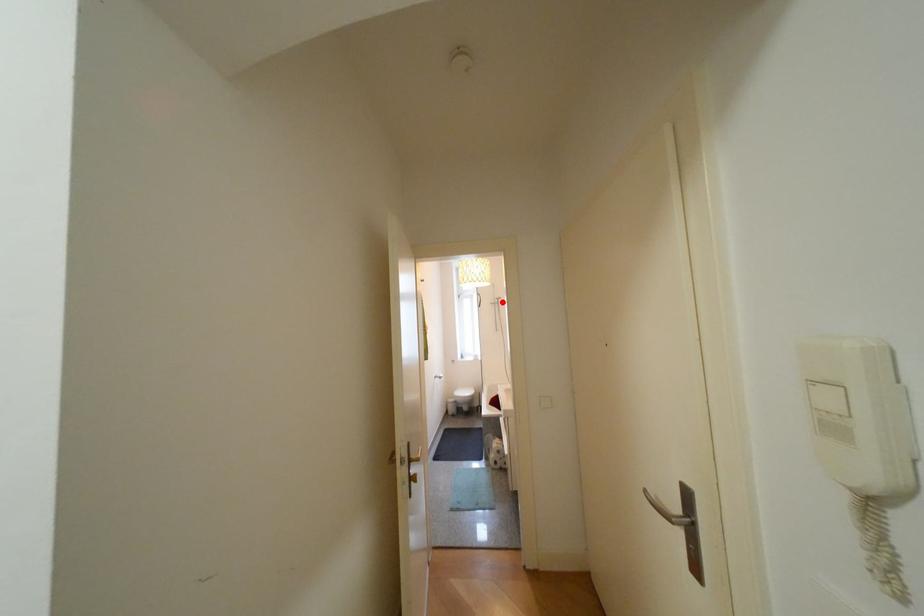
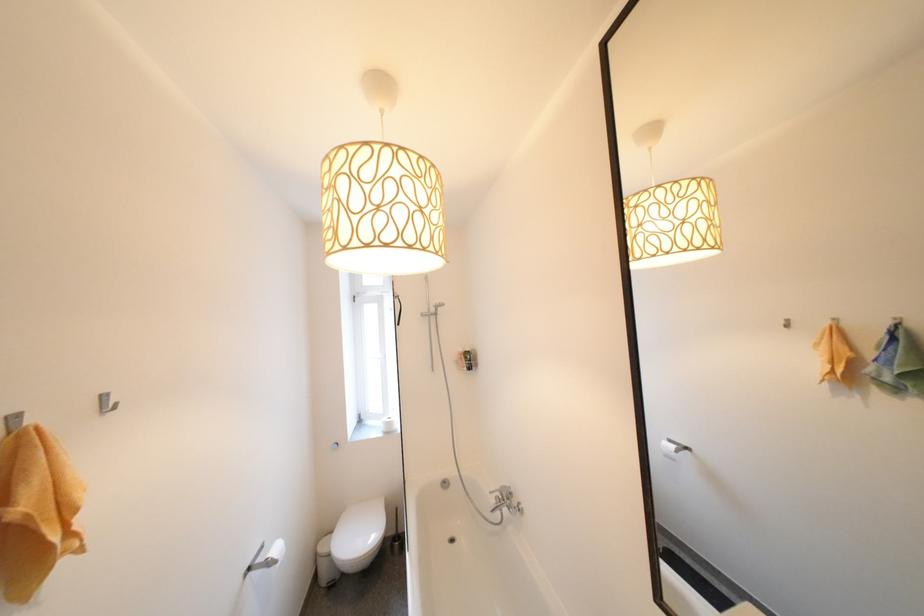
The point at the highlighted location is marked in the first image. Where is the corresponding point in the second image?

(434, 312)